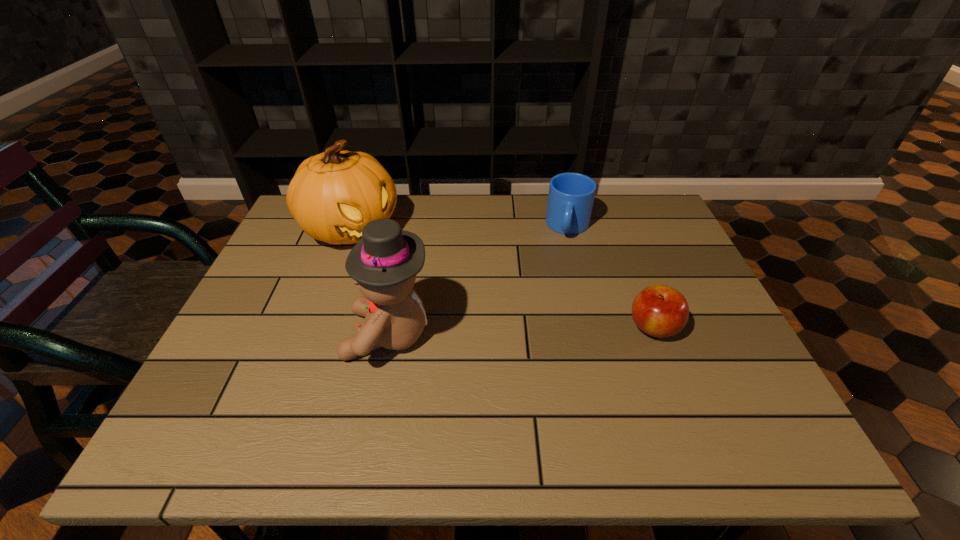
Point out which object is positioned as the nearest to the pumpkin. Please provide its 2D coordinates. Your answer should be formatted as a tuple, i.e. [(x, y)], where the tuple contains the x and y coordinates of a point satisfying the conditions above.

[(384, 263)]

I want to click on free space in the image that satisfies the following two spatial constraints: 1. on the front side of the rag_doll; 2. on the front-facing side of the pumpkin, so click(x=312, y=335).

Locate an element on the screen. This screenshot has height=540, width=960. blank area in the image that satisfies the following two spatial constraints: 1. on the front side of the pumpkin; 2. on the front-facing side of the rag_doll is located at coordinates (312, 335).

Where is `vacant area that satisfies the following two spatial constraints: 1. on the front side of the pumpkin; 2. on the front-facing side of the rag_doll`? This screenshot has width=960, height=540. vacant area that satisfies the following two spatial constraints: 1. on the front side of the pumpkin; 2. on the front-facing side of the rag_doll is located at coordinates (312, 335).